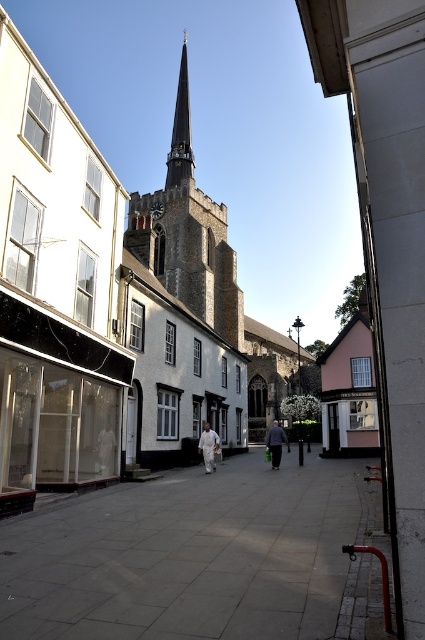
Consider the image. Can you confirm if dark gray stone tower at center is wider than white fabric person at center?

Yes, dark gray stone tower at center is wider than white fabric person at center.

Is dark gray stone tower at center shorter than white fabric person at center?

No, dark gray stone tower at center is not shorter than white fabric person at center.

Which is behind, point (214, 275) or point (201, 436)?

Positioned behind is point (214, 275).

You are a GUI agent. You are given a task and a screenshot of the screen. Output one action in this format:
    pyautogui.click(x=<x>, y=<y>)
    Task: Click on the dark gray stone tower at center
    
    Given the screenshot: What is the action you would take?
    pyautogui.click(x=192, y=232)

Which is more to the right, white fabric person at center or dark gray fabric coat at center?

From the viewer's perspective, dark gray fabric coat at center appears more on the right side.

Is point (201, 448) behind point (269, 442)?

That is False.

Between point (206, 460) and point (271, 452), which one is positioned in front?

Point (206, 460) is more forward.

You are a GUI agent. You are given a task and a screenshot of the screen. Output one action in this format:
    pyautogui.click(x=<x>, y=<y>)
    Task: Click on the white fabric person at center
    
    Given the screenshot: What is the action you would take?
    tap(209, 448)

Does gray concrete pavement at center come in front of white fabric person at center?

Yes, gray concrete pavement at center is closer to the viewer.

Between gray concrete pavement at center and white fabric person at center, which one is positioned lower?

Positioned lower is white fabric person at center.

Find the location of a particular element. The image size is (425, 640). gray concrete pavement at center is located at coordinates (195, 557).